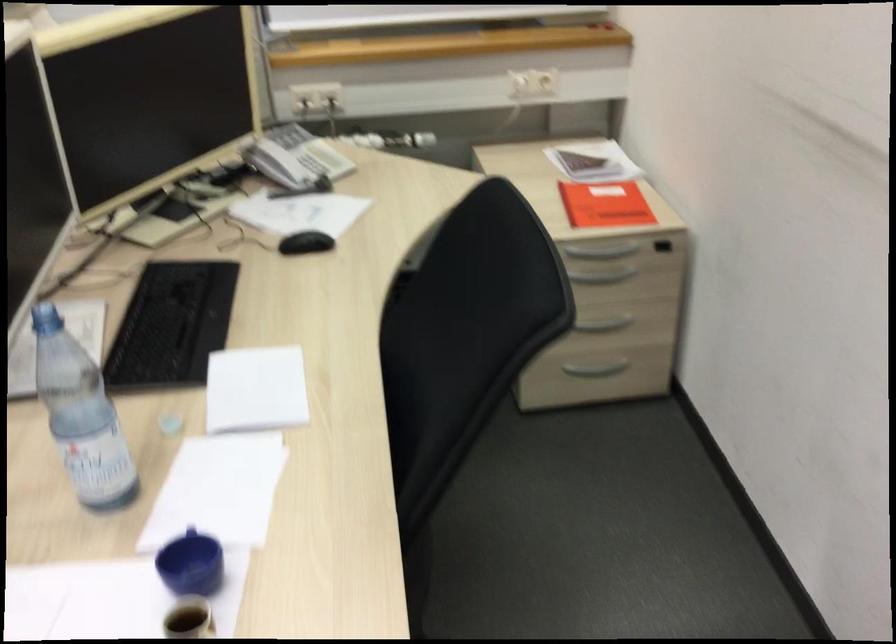
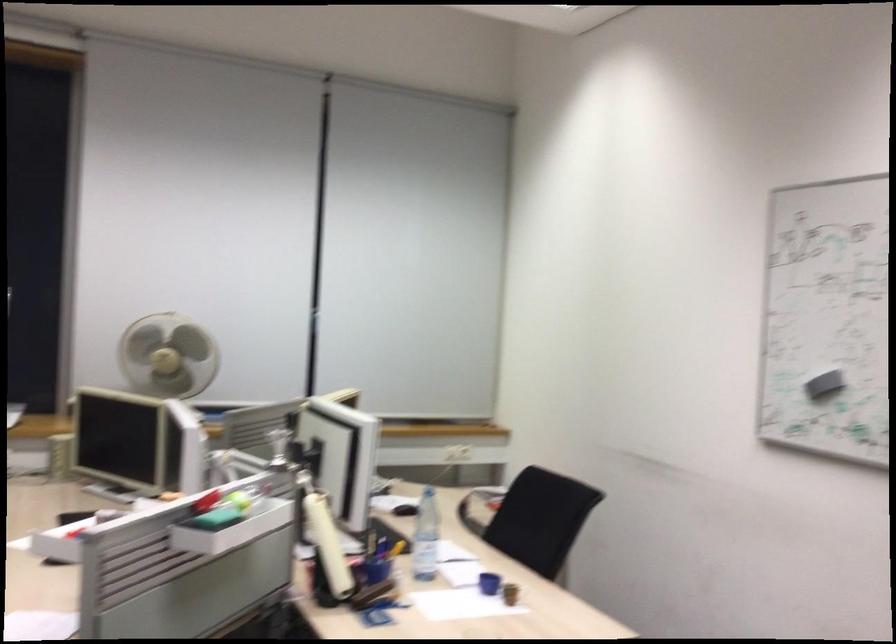
Find the pixel in the second image that matches point (107, 436) in the first image.

(426, 536)